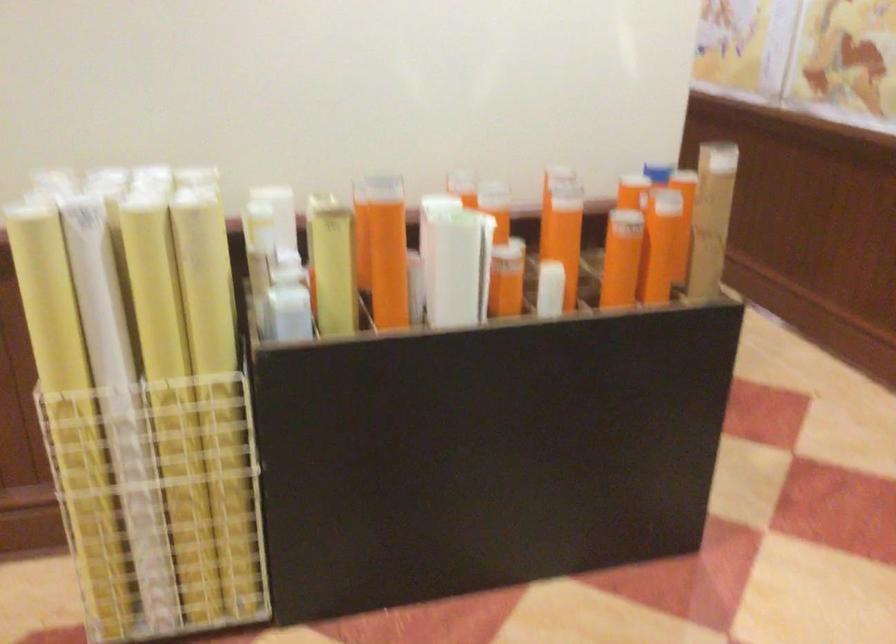
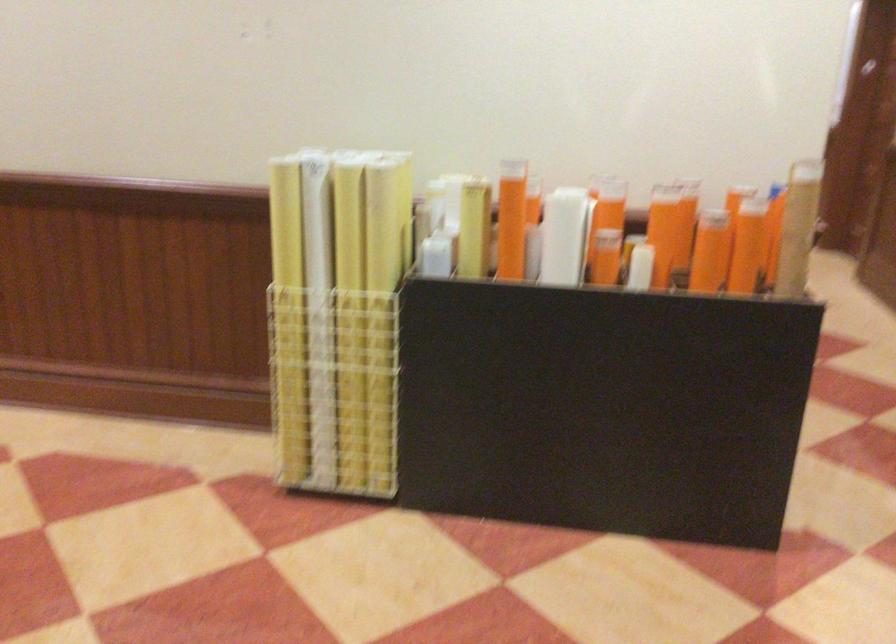
Find the pixel in the second image that matches point 574,232 in the first image.

(669, 227)